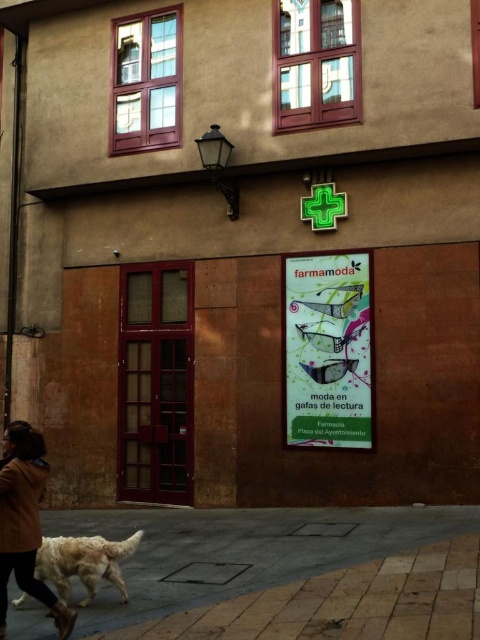
Question: Can you confirm if matte paper poster at center is wider than golden fur dog at lower left?

Choices:
 (A) no
 (B) yes

Answer: (A)

Question: Which point is closer to the camera?

Choices:
 (A) golden fur dog at lower left
 (B) brown leather jacket at lower left
 (C) brick pavement at lower center
 (D) matte paper poster at center

Answer: (B)

Question: In this image, where is brick pavement at lower center located relative to matte paper poster at center?

Choices:
 (A) above
 (B) below

Answer: (B)

Question: Which of the following is the closest to the observer?

Choices:
 (A) brown leather jacket at lower left
 (B) golden fur dog at lower left
 (C) brick pavement at lower center

Answer: (A)

Question: Is brown leather jacket at lower left wider than golden fur dog at lower left?

Choices:
 (A) yes
 (B) no

Answer: (B)

Question: Which point is closer to the camera taking this photo?

Choices:
 (A) (21, 632)
 (B) (21, 531)
 (C) (56, 568)

Answer: (B)